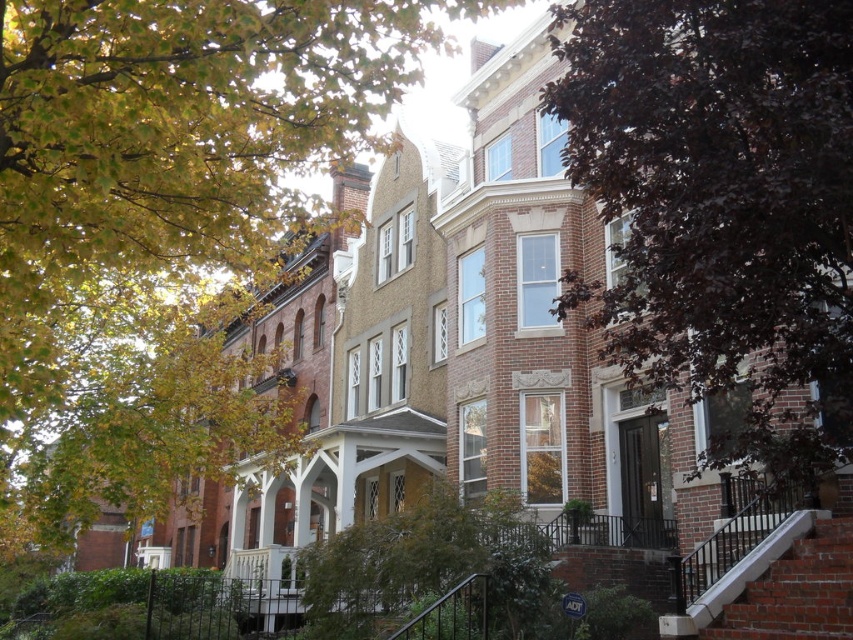
Does green leafy tree at upper left appear on the right side of purple leafy tree at center?

No, green leafy tree at upper left is not to the right of purple leafy tree at center.

Which is below, green leafy tree at upper left or purple leafy tree at center?

Positioned lower is purple leafy tree at center.

The width and height of the screenshot is (853, 640). Describe the element at coordinates (163, 225) in the screenshot. I see `green leafy tree at upper left` at that location.

I want to click on green leafy tree at upper left, so click(x=163, y=225).

Can you confirm if green leafy tree at upper left is wider than white concrete stairs at lower right?

Yes.

Between green leafy tree at upper left and white concrete stairs at lower right, which one appears on the right side from the viewer's perspective?

Positioned to the right is white concrete stairs at lower right.

Is point (90, 483) behind point (798, 545)?

That is True.

You are a GUI agent. You are given a task and a screenshot of the screen. Output one action in this format:
    pyautogui.click(x=<x>, y=<y>)
    Task: Click on the green leafy tree at upper left
    
    Given the screenshot: What is the action you would take?
    pyautogui.click(x=163, y=225)

Who is positioned more to the right, purple leafy tree at center or white concrete stairs at lower right?

Positioned to the right is white concrete stairs at lower right.

Is point (577, 86) in front of point (778, 561)?

That is True.

Is point (828, 468) farther from viewer compared to point (728, 614)?

No, it is in front of (728, 614).

This screenshot has width=853, height=640. In order to click on purple leafy tree at center in this screenshot , I will do `click(721, 204)`.